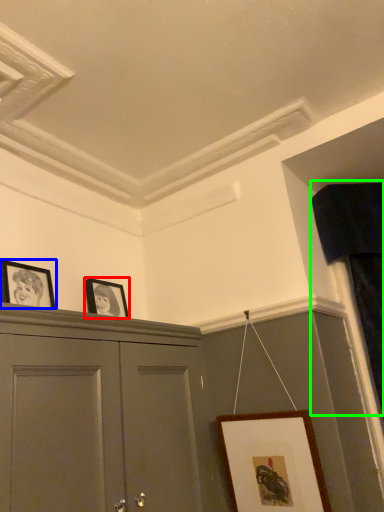
Question: Estimate the real-world distances between objects in this image. Which object is farther from picture frame (highlighted by a red box), picture frame (highlighted by a blue box) or curtain (highlighted by a green box)?

Choices:
 (A) picture frame
 (B) curtain

Answer: (B)